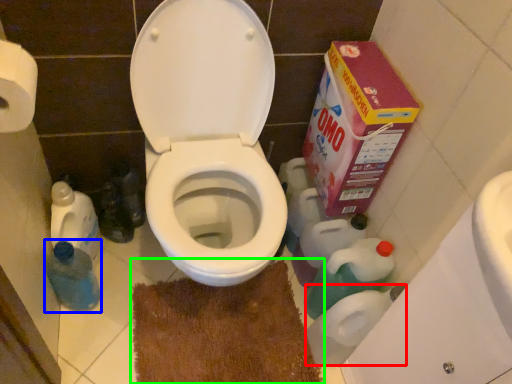
Question: Which object is the closest to the toilet paper (highlighted by a red box)? Choose among these: cleaning product (highlighted by a blue box) or bath mat (highlighted by a green box).

Choices:
 (A) cleaning product
 (B) bath mat

Answer: (B)